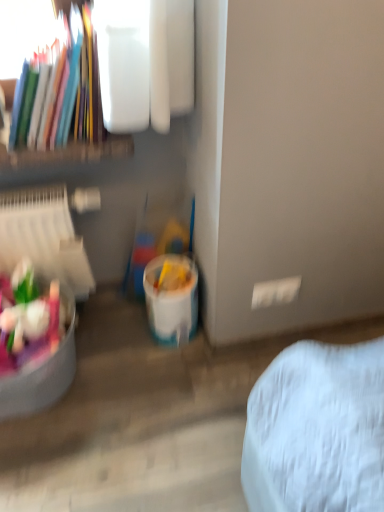
Locate an element on the screen. The image size is (384, 512). free spot to the left of white plastic bucket at lower center is located at coordinates (121, 331).